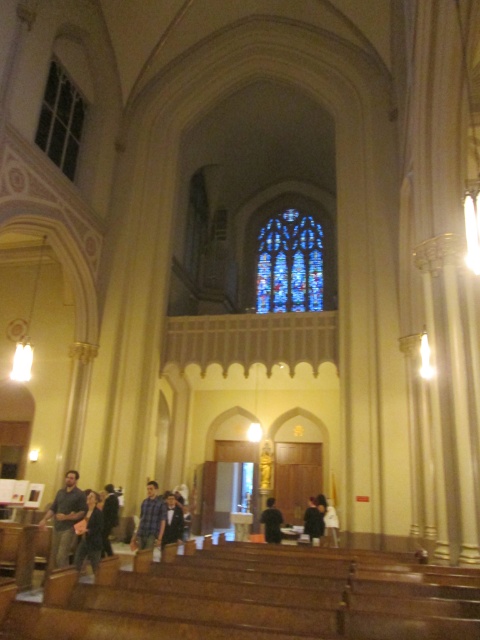
Question: Does clear glass window at upper left have a lesser width compared to white cotton shirt at center?

Choices:
 (A) yes
 (B) no

Answer: (A)

Question: Which of the following is the closest to the observer?

Choices:
 (A) (265, 525)
 (B) (108, 547)

Answer: (B)

Question: Which object is closer to the camera taking this photo?

Choices:
 (A) white cotton shirt at center
 (B) dark blue shirt at lower left

Answer: (B)

Question: From the image, what is the correct spatial relationship of stained glass window at center in relation to dark brown leather jacket at lower center?

Choices:
 (A) left
 (B) right

Answer: (A)

Question: Considering the relative positions of dark gray sweater at lower left and blue plaid shirt at center in the image provided, where is dark gray sweater at lower left located with respect to blue plaid shirt at center?

Choices:
 (A) above
 (B) below

Answer: (A)

Question: Among these objects, which one is nearest to the camera?

Choices:
 (A) dark blue shirt at lower left
 (B) clear glass window at upper left

Answer: (A)